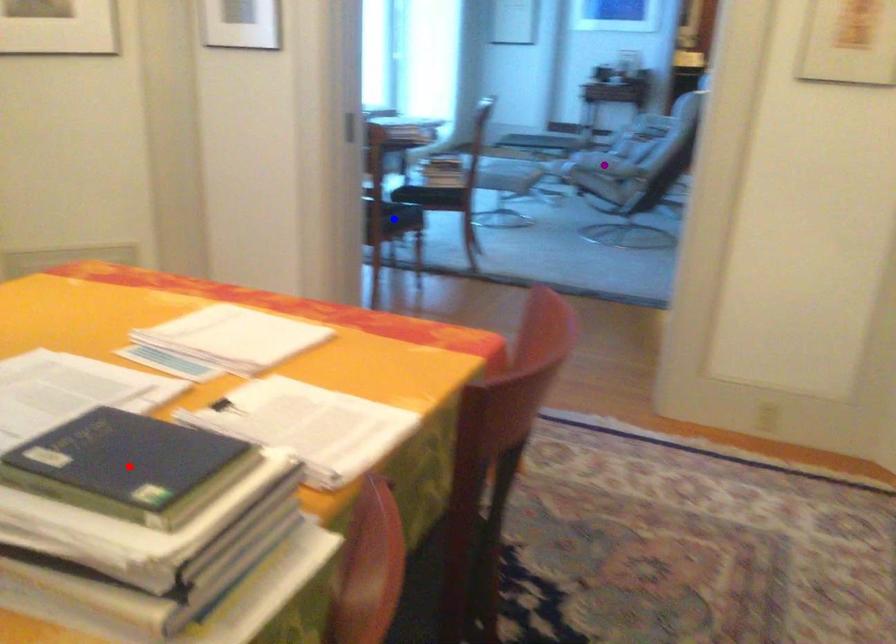
Order these from nearest to farthest:
A) purple point
B) blue point
C) red point

purple point
blue point
red point